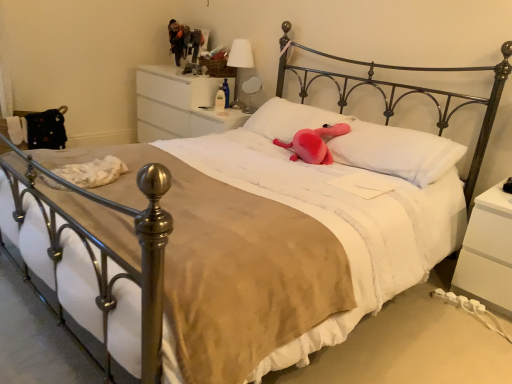
Question: Is pink plush toy at center shorter than white glossy nightstand at upper center, acting as the 2th nightstand starting from the front?

Choices:
 (A) yes
 (B) no

Answer: (A)

Question: Can white glossy nightstand at upper center, which ranks as the second nightstand in back-to-front order, be found inside pink plush toy at center?

Choices:
 (A) yes
 (B) no

Answer: (B)

Question: Can you confirm if pink plush toy at center is smaller than white glossy nightstand at upper center, the 2th nightstand positioned from the right?

Choices:
 (A) no
 (B) yes

Answer: (B)

Question: Is pink plush toy at center taller than white glossy nightstand at upper center, which ranks as the second nightstand in back-to-front order?

Choices:
 (A) yes
 (B) no

Answer: (B)

Question: Can you confirm if pink plush toy at center is thinner than white glossy nightstand at upper center, the 2th nightstand from the bottom?

Choices:
 (A) yes
 (B) no

Answer: (A)

Question: Considering the positions of white glossy drawer at upper center, marked as the 3th nightstand in a bottom-to-top arrangement, and white glossy table lamp at upper center, which appears as the second table lamp when viewed from the top, in the image, is white glossy drawer at upper center, marked as the 3th nightstand in a bottom-to-top arrangement, wider or thinner than white glossy table lamp at upper center, which appears as the second table lamp when viewed from the top,?

Choices:
 (A) thin
 (B) wide

Answer: (B)

Question: From a real-world perspective, is white glossy drawer at upper center, acting as the first nightstand starting from the back, above or below white glossy table lamp at upper center, which appears as the second table lamp when viewed from the top?

Choices:
 (A) below
 (B) above

Answer: (A)

Question: Is white glossy drawer at upper center, the 1th nightstand positioned from the left, in front of or behind white glossy table lamp at upper center, which is counted as the first table lamp, starting from the bottom, in the image?

Choices:
 (A) front
 (B) behind

Answer: (B)

Question: In terms of size, does white glossy drawer at upper center, the 3th nightstand from the front, appear bigger or smaller than white glossy table lamp at upper center, which appears as the second table lamp when viewed from the top?

Choices:
 (A) small
 (B) big

Answer: (B)

Question: From the image's perspective, is white fabric-covered table lamp at upper center, acting as the 1th table lamp starting from the top, positioned above or below white matte nightstand at lower right, the 3th nightstand when ordered from top to bottom?

Choices:
 (A) above
 (B) below

Answer: (A)

Question: In terms of width, does white fabric-covered table lamp at upper center, the 2th table lamp when ordered from bottom to top, look wider or thinner when compared to white matte nightstand at lower right, marked as the 3th nightstand in a back-to-front arrangement?

Choices:
 (A) thin
 (B) wide

Answer: (A)

Question: Is white fabric-covered table lamp at upper center, acting as the 1th table lamp starting from the top, to the left or to the right of white matte nightstand at lower right, the 3th nightstand when ordered from top to bottom, in the image?

Choices:
 (A) right
 (B) left

Answer: (B)

Question: In the image, is white fabric-covered table lamp at upper center, acting as the 1th table lamp starting from the top, positioned in front of or behind white matte nightstand at lower right, positioned as the first nightstand in right-to-left order?

Choices:
 (A) behind
 (B) front

Answer: (A)

Question: In terms of size, does white glossy table lamp at upper center, which is counted as the first table lamp, starting from the bottom, appear bigger or smaller than white matte nightstand at lower right, which ranks as the 1th nightstand in bottom-to-top order?

Choices:
 (A) small
 (B) big

Answer: (A)

Question: From a real-world perspective, is white glossy table lamp at upper center, which appears as the second table lamp when viewed from the top, positioned above or below white matte nightstand at lower right, the 1th nightstand viewed from the front?

Choices:
 (A) above
 (B) below

Answer: (A)